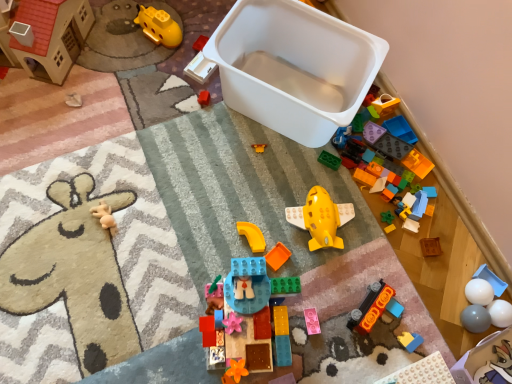
The image size is (512, 384). What are the coordinates of `free space to the back side of pink matte block at center, the 7th toy from the left` in the screenshot? It's located at (319, 268).